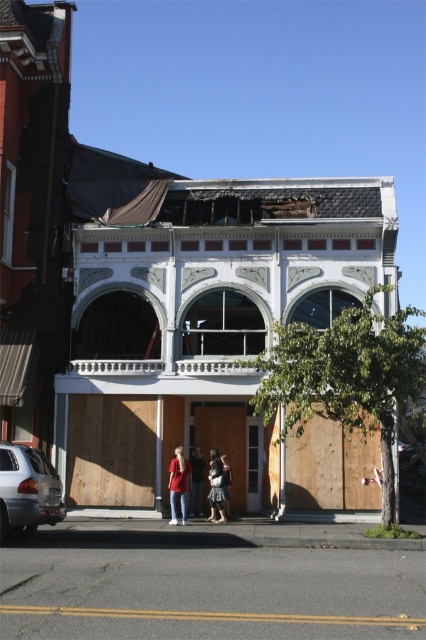
In the scene shown: You are standing on the sidewalk in front of the building and notice two people wearing denim pants at lower center and light brown leather jacket at center. Which one is more to the left?

The denim pants at lower center is more to the left than the light brown leather jacket at center.

You are a pedestrian standing on the sidewalk in front of the building. You see a silver metallic car at lower left and a denim skirt at center. Which object is positioned higher from the ground?

The silver metallic car at lower left is located above denim skirt at center, so it is positioned higher from the ground.

You are standing on the sidewalk in front of the building and notice a specific location marked by a point at coordinates (178, 484). What object is located at this point?

The point at coordinates (178, 484) indicates denim pants at lower center.